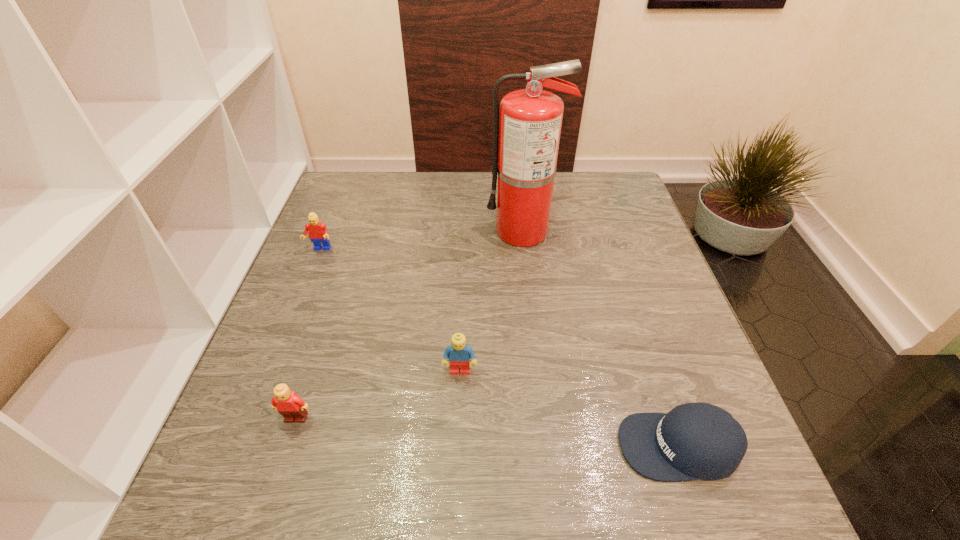
Where is `free spot between the leftmost Lego and the second farthest Lego`? free spot between the leftmost Lego and the second farthest Lego is located at coordinates (390, 310).

Where is `unoccupied area between the tallest object and the shortest object`? The image size is (960, 540). unoccupied area between the tallest object and the shortest object is located at coordinates (601, 339).

Where is `free area in between the second Lego from left to right and the third farthest object`? free area in between the second Lego from left to right and the third farthest object is located at coordinates (378, 394).

Locate an element on the screen. free space between the baseball cap and the leftmost Lego is located at coordinates click(499, 348).

Locate an element on the screen. The width and height of the screenshot is (960, 540). vacant area that lies between the second farthest Lego and the shortest object is located at coordinates (569, 408).

I want to click on empty space between the rightmost Lego and the farthest Lego, so click(390, 310).

Where is `empty space between the leftmost Lego and the baseball cap`? The height and width of the screenshot is (540, 960). empty space between the leftmost Lego and the baseball cap is located at coordinates (499, 348).

Locate an element on the screen. The height and width of the screenshot is (540, 960). vacant space that is in between the second Lego from right to left and the baseball cap is located at coordinates (488, 432).

At what (x,y) coordinates should I click in order to perform the action: click on free space between the second nearest Lego and the baseball cap. Please return your answer as a coordinate pair (x, y). The height and width of the screenshot is (540, 960). Looking at the image, I should click on (569, 408).

Identify which object is the closest to the shortest object. Please provide its 2D coordinates. Your answer should be formatted as a tuple, i.e. [(x, y)], where the tuple contains the x and y coordinates of a point satisfying the conditions above.

[(459, 353)]